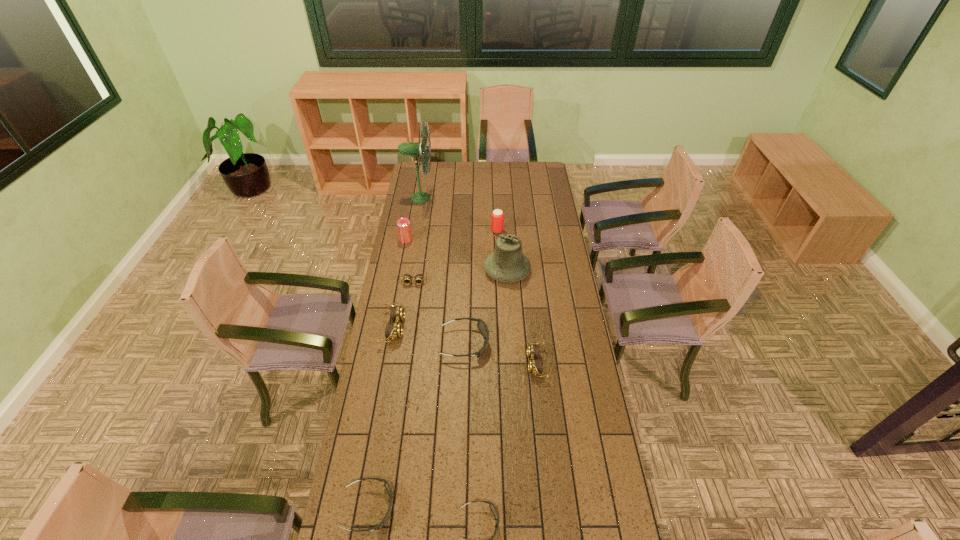
Find the location of a particular element. The width and height of the screenshot is (960, 540). the second closest goggles to the farthest object is located at coordinates (394, 330).

Locate which goggles ranks fourth in proximity to the tallest goggles. Please provide its 2D coordinates. Your answer should be formatted as a tuple, i.e. [(x, y)], where the tuple contains the x and y coordinates of a point satisfying the conditions above.

[(386, 484)]

Find the location of a particular element. The width and height of the screenshot is (960, 540). brown goggles that is the closest to the biggest brown goggles is located at coordinates (419, 278).

Choose which brown goggles is the nearest neighbor to the sixth shortest object. Please provide its 2D coordinates. Your answer should be formatted as a tuple, i.e. [(x, y)], where the tuple contains the x and y coordinates of a point satisfying the conditions above.

[(419, 278)]

Identify the location of black goggles that is the second closest to the shortest object. (481, 325).

The width and height of the screenshot is (960, 540). Identify the location of black goggles object that ranks as the third closest to the nearer beer can. (491, 505).

Locate an element on the screen. vacant space that satisfies the following two spatial constraints: 1. through the lenses of the smallest brown goggles; 2. on the lenses of the leftmost black goggles is located at coordinates (381, 508).

This screenshot has width=960, height=540. In order to click on vacant space that satisfies the following two spatial constraints: 1. through the lenses of the farthest goggles; 2. on the lenses of the leftmost black goggles in this screenshot , I will do `click(381, 508)`.

Find the location of `vacant position in the image that satisfies the following two spatial constraints: 1. through the lenses of the farthest brown goggles; 2. on the lenses of the second smallest black goggles`. vacant position in the image that satisfies the following two spatial constraints: 1. through the lenses of the farthest brown goggles; 2. on the lenses of the second smallest black goggles is located at coordinates (381, 508).

Find the location of a particular element. The image size is (960, 540). free space that satisfies the following two spatial constraints: 1. on the front-facing side of the red beer can; 2. on the right side of the fan is located at coordinates (415, 231).